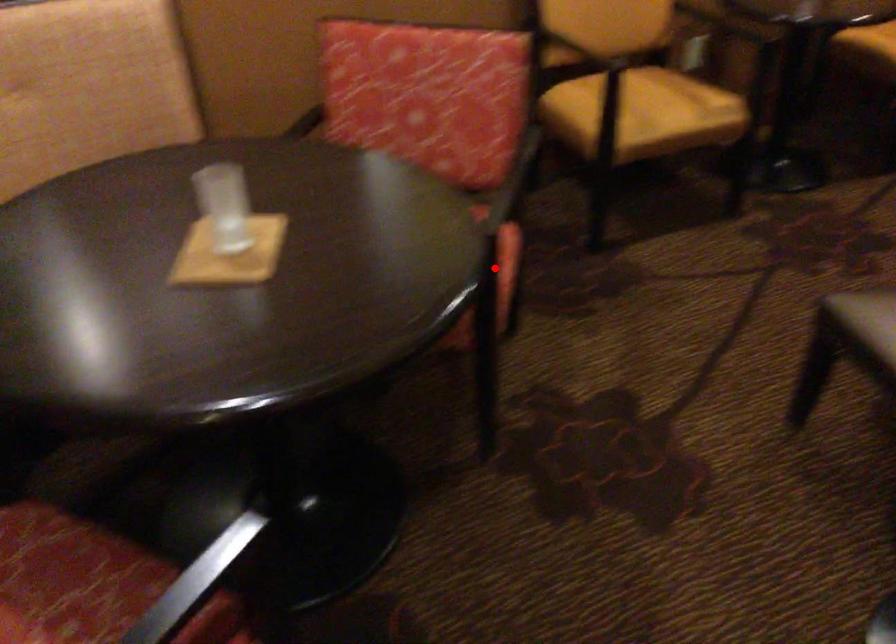
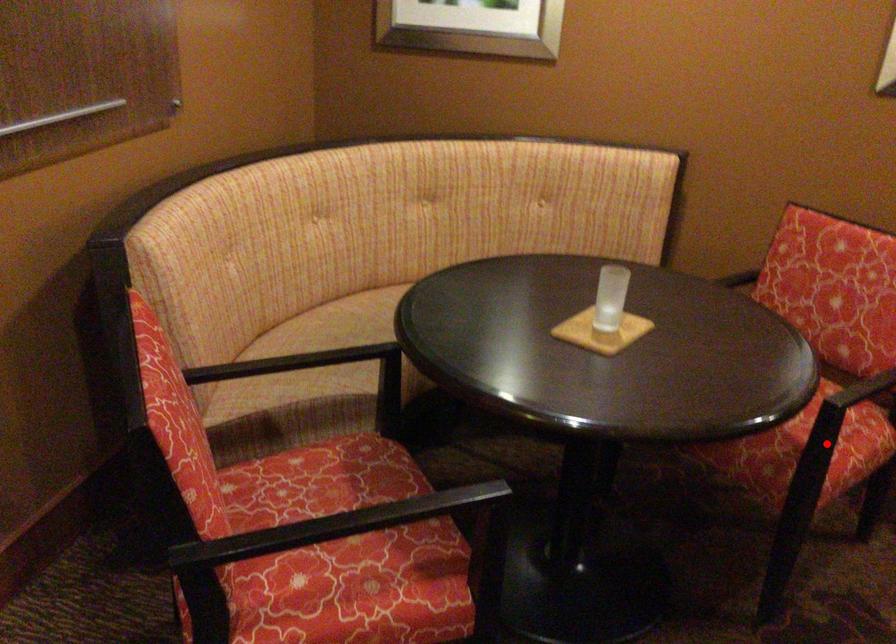
I am providing you with two images of the same scene from different viewpoints. A red point is marked on the first image and another point is marked on the second image. Is the marked point in image1 the same physical position as the marked point in image2?

Yes